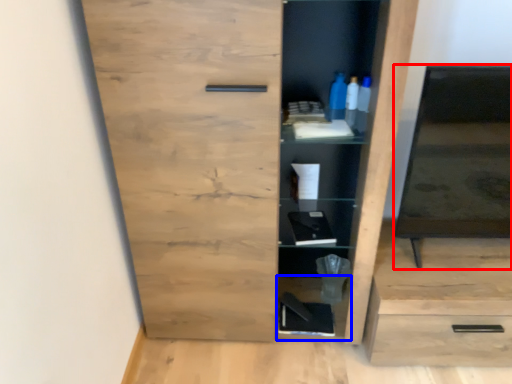
Question: Which of the following is the closest to the observer, medicine cabinet (highlighted by a red box) or cabinet (highlighted by a blue box)?

Choices:
 (A) medicine cabinet
 (B) cabinet

Answer: (A)